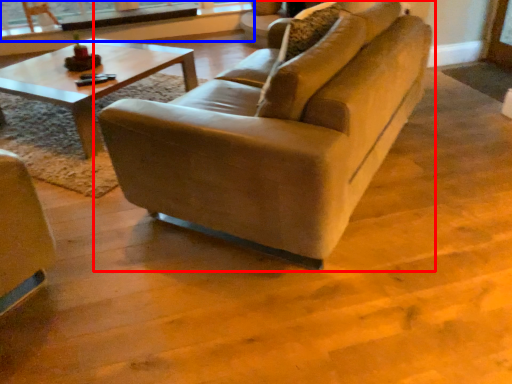
Question: Among these objects, which one is farthest to the camera, studio couch (highlighted by a red box) or window frame (highlighted by a blue box)?

Choices:
 (A) studio couch
 (B) window frame

Answer: (B)